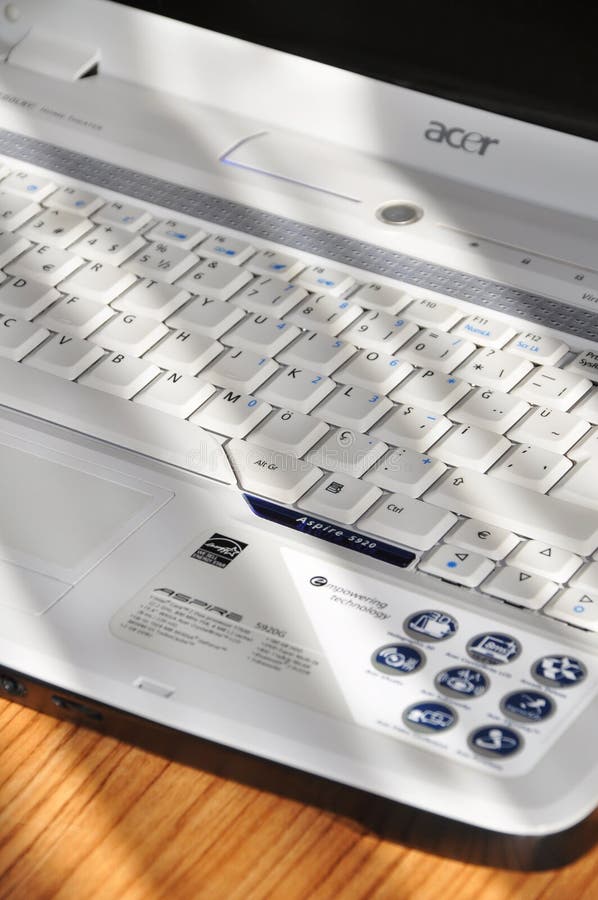
Locate an element on the screen. Image resolution: width=598 pixels, height=900 pixels. screen is located at coordinates (518, 63).